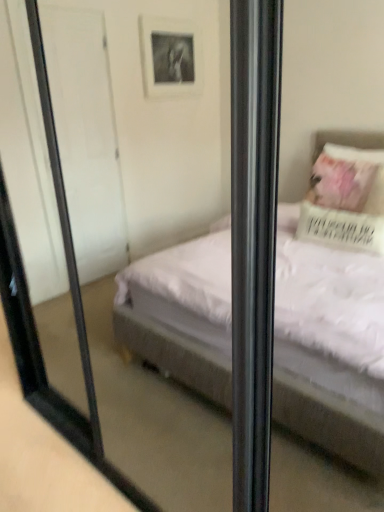
The height and width of the screenshot is (512, 384). Describe the element at coordinates (139, 224) in the screenshot. I see `transparent glass door at center` at that location.

This screenshot has height=512, width=384. Find the location of `transparent glass door at center`. transparent glass door at center is located at coordinates (139, 224).

At what (x,y) coordinates should I click in order to perform the action: click on transparent glass door at center. Please return your answer as a coordinate pair (x, y). This screenshot has width=384, height=512. Looking at the image, I should click on (139, 224).